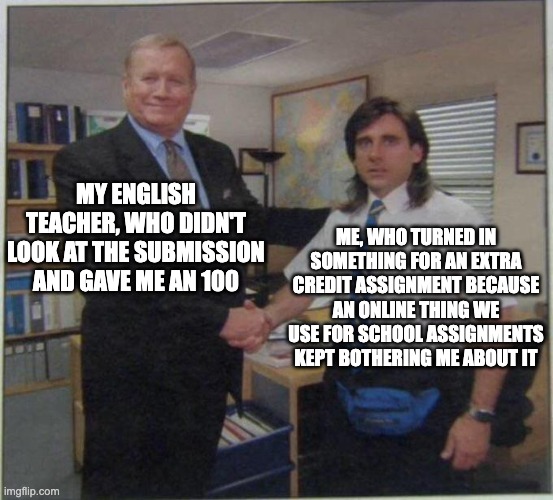
Where is `desk`? The height and width of the screenshot is (500, 553). desk is located at coordinates (295, 376), (76, 339).